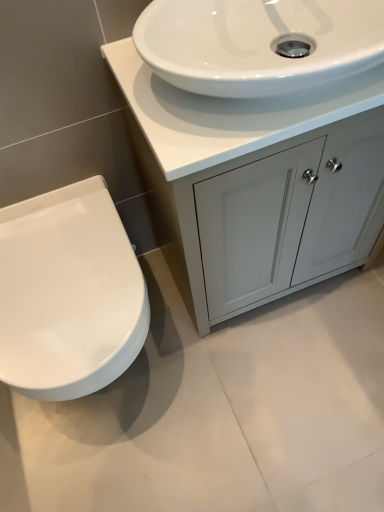
Question: Considering their positions, is white glossy sink at upper center located in front of or behind white glossy toilet at left?

Choices:
 (A) behind
 (B) front

Answer: (B)

Question: Based on their positions, is white glossy sink at upper center located to the left or right of white glossy toilet at left?

Choices:
 (A) left
 (B) right

Answer: (B)

Question: Which object is the closest to the matte white cabinet at center?

Choices:
 (A) white glossy toilet at left
 (B) white glossy sink at upper center

Answer: (B)

Question: Estimate the real-world distances between objects in this image. Which object is farther from the matte white cabinet at center?

Choices:
 (A) white glossy toilet at left
 (B) white glossy sink at upper center

Answer: (A)